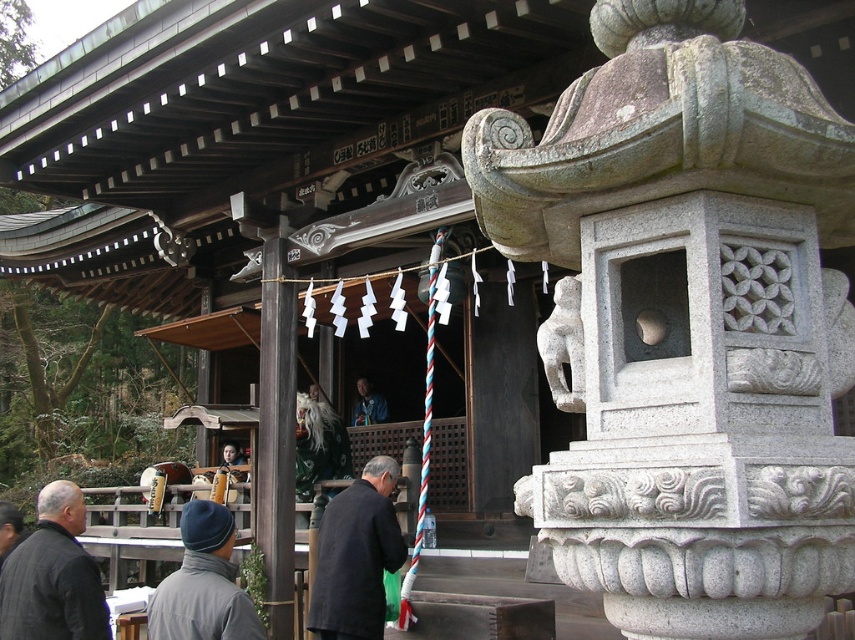
Question: Which of the following is the farthest from the observer?

Choices:
 (A) (380, 554)
 (B) (71, 536)
 (C) (210, 520)

Answer: (A)

Question: Which object is closer to the camera taking this photo?

Choices:
 (A) dark gray wool jacket at lower left
 (B) dark gray coat at center

Answer: (A)

Question: Can you confirm if dark gray coat at center is positioned to the left of dark gray woolen hat at center?

Choices:
 (A) no
 (B) yes

Answer: (A)

Question: Which object appears closest to the camera in this image?

Choices:
 (A) dark gray wool jacket at lower left
 (B) dark gray woolen hat at center

Answer: (B)

Question: Can you confirm if dark gray wool jacket at lower left is positioned below dark gray woolen hat at center?

Choices:
 (A) yes
 (B) no

Answer: (A)

Question: Is dark gray wool jacket at lower left smaller than dark gray woolen hat at center?

Choices:
 (A) no
 (B) yes

Answer: (A)